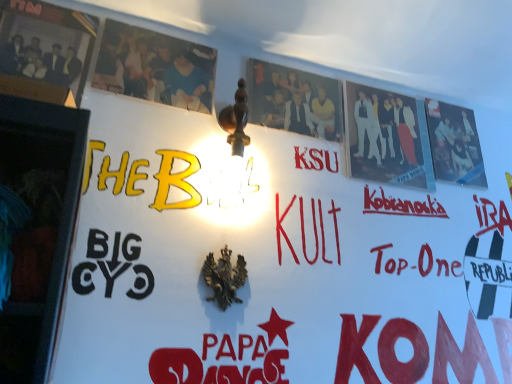
Question: Considering the relative sizes of matte paper poster at center, which ranks as the third poster in left-to-right order, and matte black photo frame at upper left, which is counted as the 1th poster, starting from the left, in the image provided, is matte paper poster at center, which ranks as the third poster in left-to-right order, smaller than matte black photo frame at upper left, which is counted as the 1th poster, starting from the left,?

Choices:
 (A) yes
 (B) no

Answer: (A)

Question: From a real-world perspective, is matte paper poster at center, which ranks as the third poster in left-to-right order, below matte black photo frame at upper left, which is counted as the 1th poster, starting from the left?

Choices:
 (A) yes
 (B) no

Answer: (B)

Question: Is matte paper poster at center, which ranks as the third poster in left-to-right order, thinner than matte black photo frame at upper left, which ranks as the fifth poster in right-to-left order?

Choices:
 (A) yes
 (B) no

Answer: (A)

Question: Does matte paper poster at center, which ranks as the third poster in right-to-left order, lie in front of matte black photo frame at upper left, which is counted as the 1th poster, starting from the left?

Choices:
 (A) yes
 (B) no

Answer: (B)

Question: Is matte paper poster at center, which ranks as the third poster in right-to-left order, not inside matte black photo frame at upper left, which ranks as the fifth poster in right-to-left order?

Choices:
 (A) no
 (B) yes

Answer: (B)

Question: Is matte paper poster at center, which ranks as the third poster in right-to-left order, bigger than matte black photo frame at upper left, which ranks as the fifth poster in right-to-left order?

Choices:
 (A) no
 (B) yes

Answer: (A)

Question: Considering the relative positions of matte black poster at upper right, which ranks as the fifth poster in left-to-right order, and matte paper poster at center, which ranks as the third poster in left-to-right order, in the image provided, is matte black poster at upper right, which ranks as the fifth poster in left-to-right order, in front of matte paper poster at center, which ranks as the third poster in left-to-right order,?

Choices:
 (A) no
 (B) yes

Answer: (A)

Question: From the image's perspective, is matte black poster at upper right, which ranks as the fifth poster in left-to-right order, on matte paper poster at center, which ranks as the third poster in left-to-right order?

Choices:
 (A) yes
 (B) no

Answer: (B)

Question: From the image's perspective, is matte black poster at upper right, which ranks as the fifth poster in left-to-right order, located beneath matte paper poster at center, which ranks as the third poster in right-to-left order?

Choices:
 (A) no
 (B) yes

Answer: (B)

Question: Is matte black poster at upper right, positioned as the first poster in right-to-left order, looking in the opposite direction of matte paper poster at center, which ranks as the third poster in left-to-right order?

Choices:
 (A) yes
 (B) no

Answer: (B)

Question: Is matte paper poster at center, which ranks as the third poster in left-to-right order, surrounded by matte black poster at upper right, which ranks as the fifth poster in left-to-right order?

Choices:
 (A) no
 (B) yes

Answer: (A)

Question: Would you say matte black poster at upper right, which ranks as the fifth poster in left-to-right order, is a long distance from matte paper poster at center, which ranks as the third poster in right-to-left order?

Choices:
 (A) yes
 (B) no

Answer: (B)

Question: Is silhouette paper poster at upper right, the 4th poster viewed from the left, positioned far away from matte black photo frame at upper left, which is counted as the 1th poster, starting from the left?

Choices:
 (A) no
 (B) yes

Answer: (A)